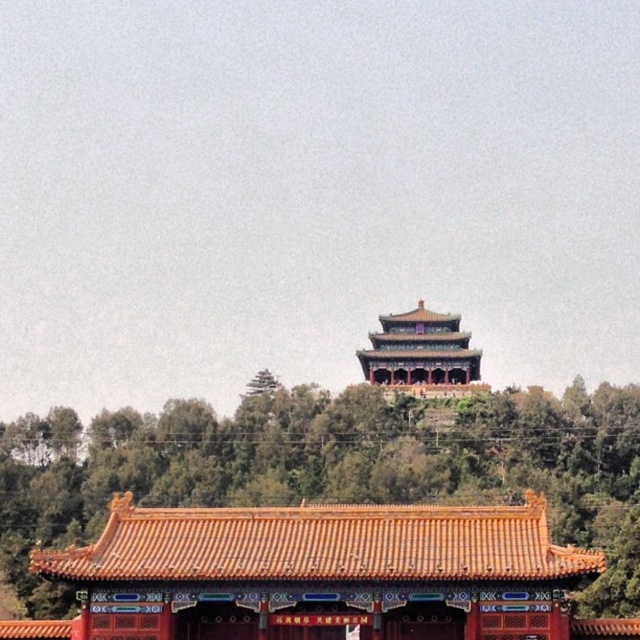
You are an architect visiting this traditional Chinese site. You notice two structures with orange glazed tile roofs. The first is labeled as the orange glazed tile roof at center, and the second is the orange glazed tile palace at center. Based on their architectural significance, which one is more likely to be the main structure of the site?

The orange glazed tile palace at center is more likely to be the main structure because palaces typically hold greater architectural and symbolic importance compared to standalone roofs. However, the orange glazed tile roof at center being much taller might suggest it has a ceremonial or prominent role. But since palaces are usually central structures in such sites, the palace is likely the main one.

You are an architect visiting this traditional Chinese site. You notice two orange glazed tile structures in the scene. Which one is bigger? The orange glazed tile roof at center or the orange glazed tile palace at center?

The orange glazed tile roof at center is larger in size compared to the orange glazed tile palace at center.